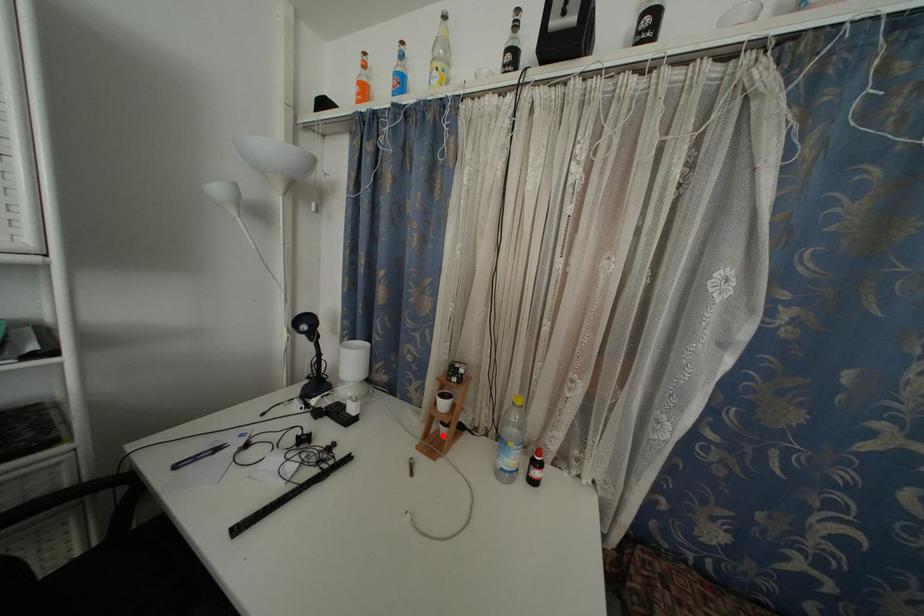
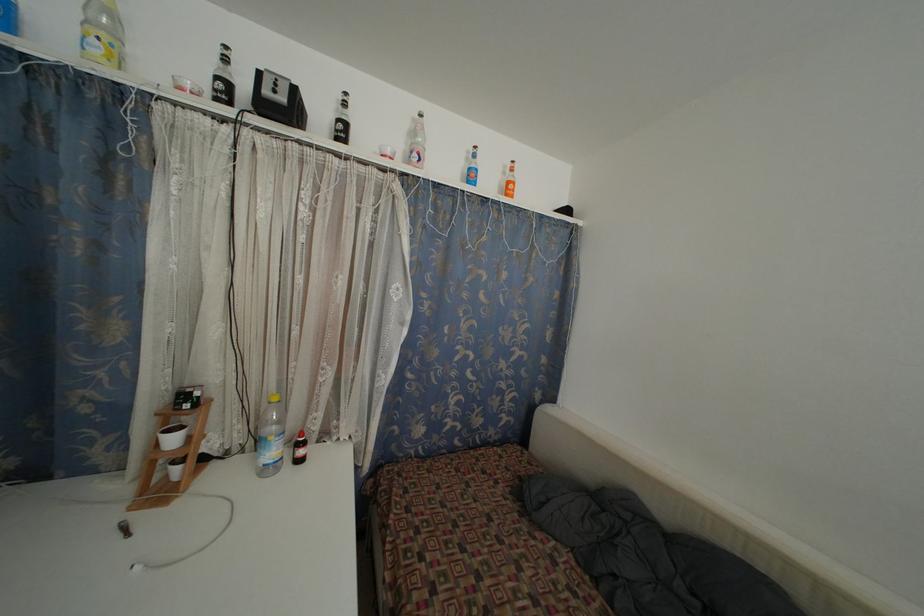
The point at the highlighted location is marked in the first image. Where is the corresponding point in the second image?

(171, 480)